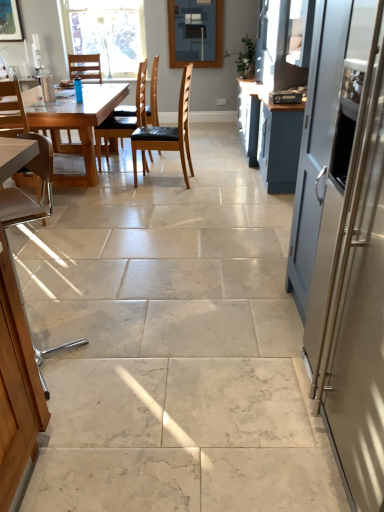
Question: From a real-world perspective, is satin silver refrigerator at right below matte glass window screen at upper center?

Choices:
 (A) yes
 (B) no

Answer: (A)

Question: Considering the relative sizes of satin silver refrigerator at right and matte glass window screen at upper center in the image provided, is satin silver refrigerator at right bigger than matte glass window screen at upper center?

Choices:
 (A) yes
 (B) no

Answer: (A)

Question: Considering the relative sizes of satin silver refrigerator at right and matte glass window screen at upper center in the image provided, is satin silver refrigerator at right smaller than matte glass window screen at upper center?

Choices:
 (A) yes
 (B) no

Answer: (B)

Question: Does satin silver refrigerator at right have a greater height compared to matte glass window screen at upper center?

Choices:
 (A) yes
 (B) no

Answer: (A)

Question: Does satin silver refrigerator at right lie behind matte glass window screen at upper center?

Choices:
 (A) no
 (B) yes

Answer: (A)

Question: Is clear glass window at upper center to the left or to the right of brown leather chair at center, arranged as the 2th chair when viewed from the front, in the image?

Choices:
 (A) left
 (B) right

Answer: (A)

Question: Is clear glass window at upper center bigger or smaller than brown leather chair at center, arranged as the 2th chair when viewed from the front?

Choices:
 (A) big
 (B) small

Answer: (B)

Question: Do you think clear glass window at upper center is within brown leather chair at center, arranged as the 3th chair when viewed from the back, or outside of it?

Choices:
 (A) inside
 (B) outside

Answer: (B)

Question: From a real-world perspective, is clear glass window at upper center physically located above or below brown leather chair at center, arranged as the 2th chair when viewed from the front?

Choices:
 (A) below
 (B) above

Answer: (B)

Question: From a real-world perspective, is clear glass window at upper center above or below matte glass window screen at upper center?

Choices:
 (A) above
 (B) below

Answer: (B)

Question: Is clear glass window at upper center taller or shorter than matte glass window screen at upper center?

Choices:
 (A) short
 (B) tall

Answer: (B)

Question: Is clear glass window at upper center inside or outside of matte glass window screen at upper center?

Choices:
 (A) inside
 (B) outside

Answer: (B)

Question: Considering the positions of clear glass window at upper center and matte glass window screen at upper center in the image, is clear glass window at upper center wider or thinner than matte glass window screen at upper center?

Choices:
 (A) wide
 (B) thin

Answer: (A)

Question: Is point (319, 368) positioned closer to the camera than point (86, 165)?

Choices:
 (A) closer
 (B) farther

Answer: (A)

Question: Visually, is satin silver refrigerator at right positioned to the left or to the right of light brown wooden table at left?

Choices:
 (A) left
 (B) right

Answer: (B)